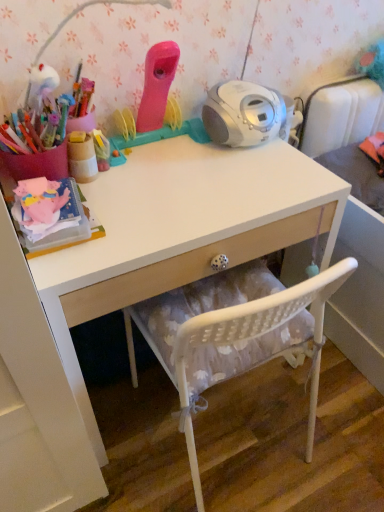
This screenshot has width=384, height=512. I want to click on spots to the right of wooden cup at upper left, so click(154, 177).